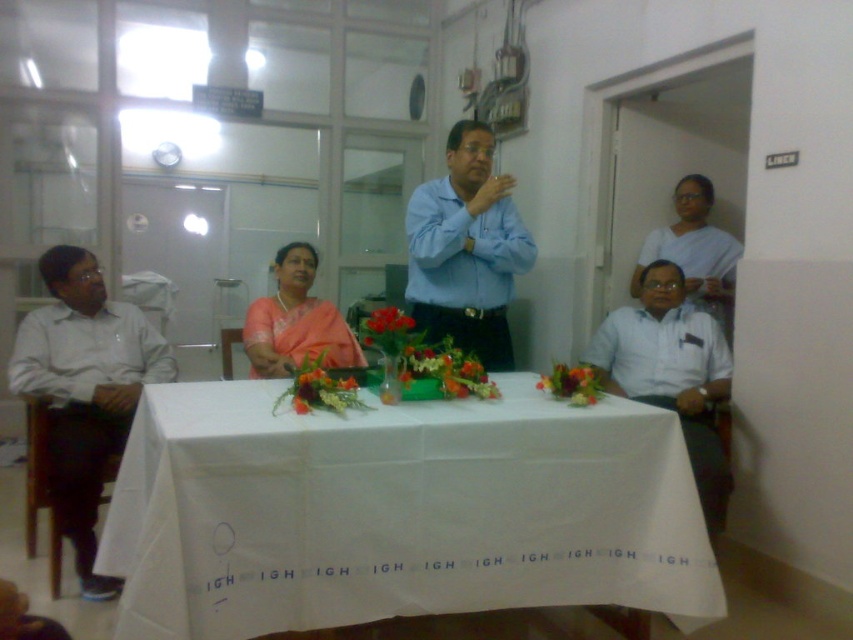
Looking at this image, is satin pink saree at center further to camera compared to white fabric saree at upper right?

No, it is in front of white fabric saree at upper right.

Between satin pink saree at center and white fabric saree at upper right, which one appears on the right side from the viewer's perspective?

white fabric saree at upper right is more to the right.

The width and height of the screenshot is (853, 640). What are the coordinates of `satin pink saree at center` in the screenshot? It's located at (294, 321).

Can you confirm if blue shirt at center is positioned below white shirt at right?

No, blue shirt at center is not below white shirt at right.

How much distance is there between blue shirt at center and white shirt at right?

blue shirt at center is 28.57 inches from white shirt at right.

This screenshot has height=640, width=853. What do you see at coordinates (466, 250) in the screenshot? I see `blue shirt at center` at bounding box center [466, 250].

Identify the location of blue shirt at center. (466, 250).

Is white shirt at right bigger than vibrant floral arrangement at center?

Yes, white shirt at right is bigger than vibrant floral arrangement at center.

Is point (598, 355) farther from viewer compared to point (296, 410)?

That is True.

What do you see at coordinates (671, 372) in the screenshot? The height and width of the screenshot is (640, 853). I see `white shirt at right` at bounding box center [671, 372].

Where is `white shirt at right`? The image size is (853, 640). white shirt at right is located at coordinates (671, 372).